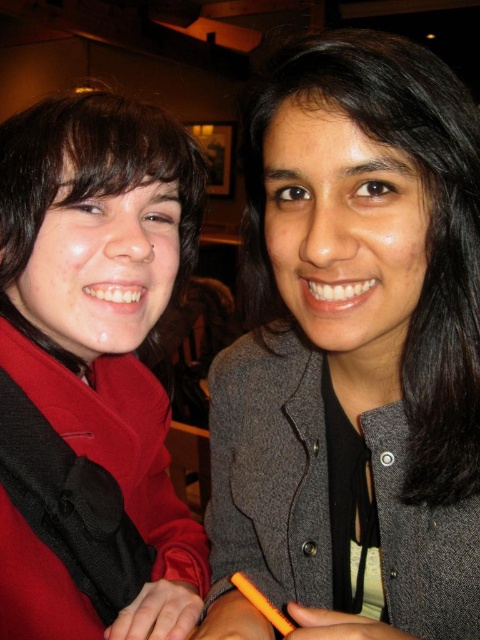
Question: Observing the image, what is the correct spatial positioning of gray woolen jacket at center in reference to matte red coat at left?

Choices:
 (A) below
 (B) above

Answer: (B)

Question: Does gray woolen jacket at center have a greater width compared to matte red coat at left?

Choices:
 (A) yes
 (B) no

Answer: (A)

Question: Which object is farther from the camera taking this photo?

Choices:
 (A) matte red coat at left
 (B) gray woolen jacket at center

Answer: (A)

Question: Can you confirm if gray woolen jacket at center is smaller than matte red coat at left?

Choices:
 (A) no
 (B) yes

Answer: (A)

Question: Which point appears farthest from the camera in this image?

Choices:
 (A) click(351, 138)
 (B) click(12, 595)

Answer: (B)